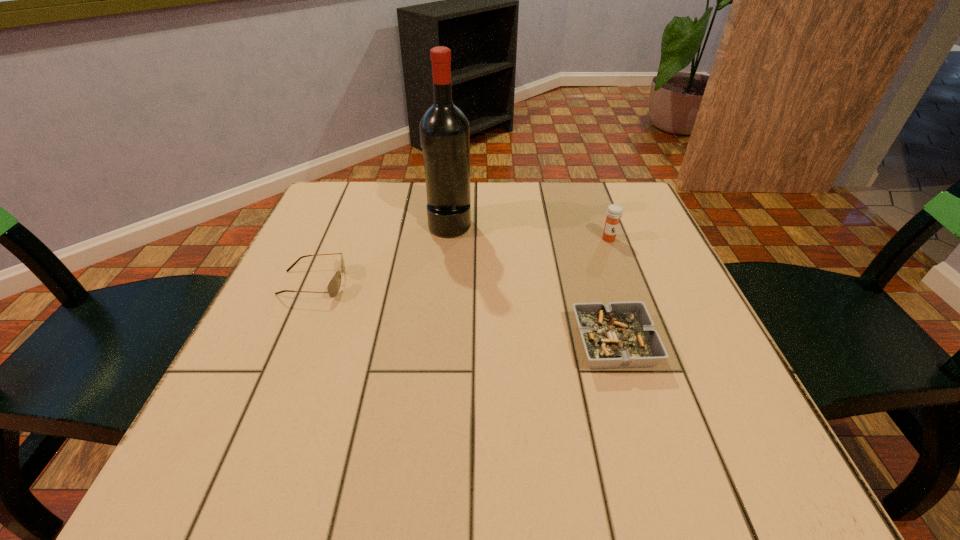
You are a GUI agent. You are given a task and a screenshot of the screen. Output one action in this format:
    pyautogui.click(x=<x>, y=<y>)
    Task: Click on the object located at the far edge
    This screenshot has height=540, width=960.
    Given the screenshot: What is the action you would take?
    pos(444,129)

Locate an element on the screen. object located at the left edge is located at coordinates (334, 285).

Find the location of a particular element. The image size is (960, 540). medicine located at the right edge is located at coordinates (614, 212).

Where is `ashtray that is at the right edge`? The height and width of the screenshot is (540, 960). ashtray that is at the right edge is located at coordinates (619, 334).

I want to click on vacant space at the far edge, so click(488, 187).

Find the location of `vacant space at the near edge of the desktop`. vacant space at the near edge of the desktop is located at coordinates (516, 478).

In the image, there is a desktop. Find the location of `free region at the left edge`. free region at the left edge is located at coordinates (276, 420).

This screenshot has height=540, width=960. I want to click on vacant region at the right edge of the desktop, so click(625, 270).

This screenshot has width=960, height=540. I want to click on vacant position at the far left corner of the desktop, so click(318, 231).

Locate an element on the screen. vacant space at the near left corner of the desktop is located at coordinates coord(235,457).